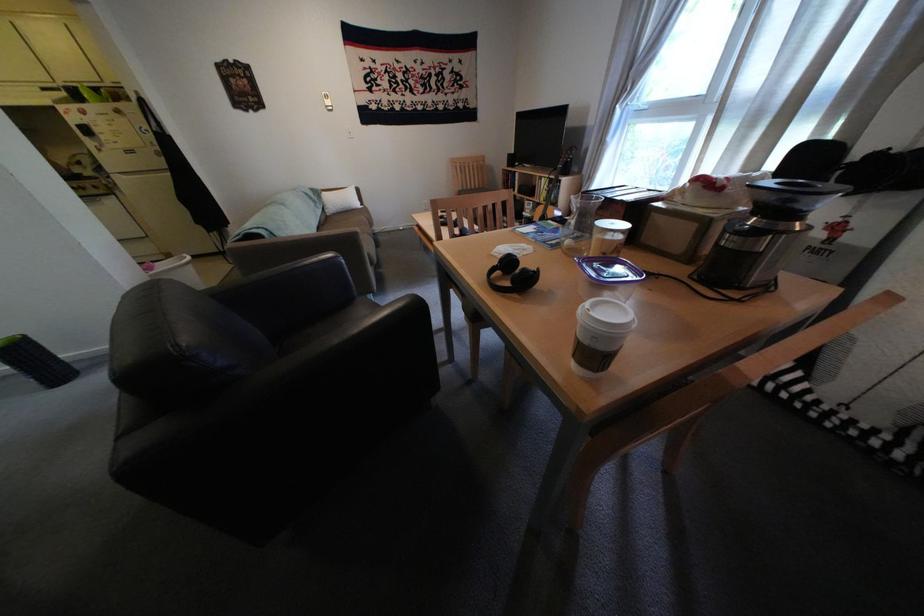
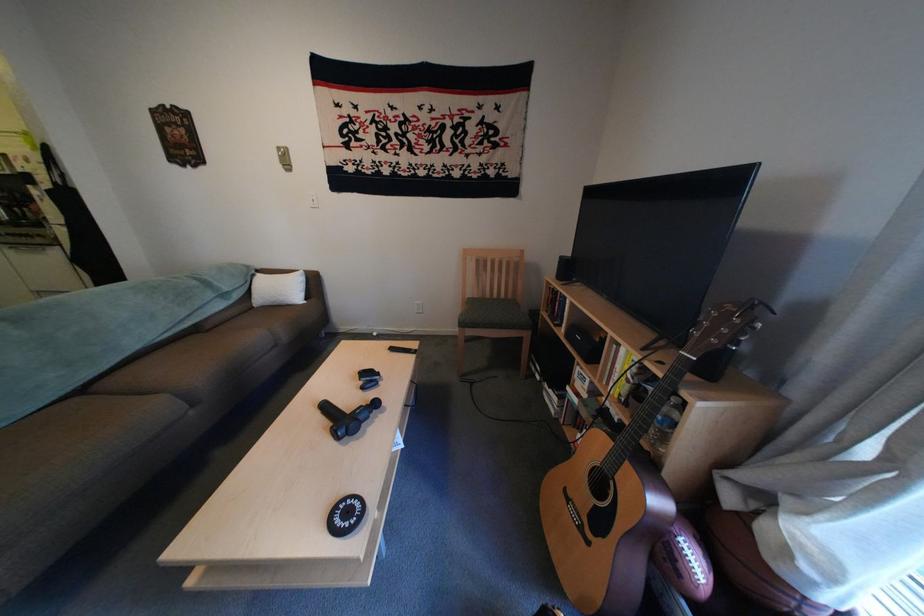
Question: In a continuous first-person perspective shot, in which direction is the camera moving?

Choices:
 (A) Left
 (B) Right
 (C) Forward
 (D) Backward

Answer: (C)